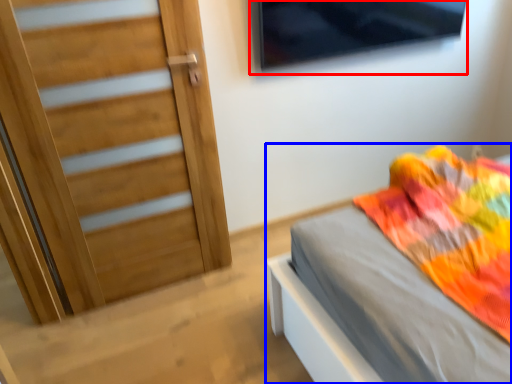
Question: Which point is closer to the camera, window (highlighted by a red box) or bed (highlighted by a blue box)?

Choices:
 (A) window
 (B) bed

Answer: (B)